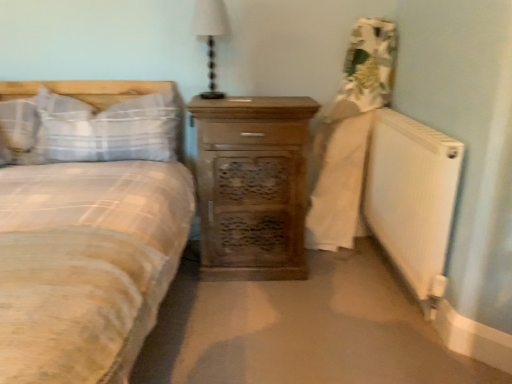
Question: Are wooden chest of drawers at center and white plaid pillow at left, which appears as the first pillow when viewed from the left, making contact?

Choices:
 (A) no
 (B) yes

Answer: (A)

Question: Considering the relative sizes of wooden chest of drawers at center and white plaid pillow at left, arranged as the second pillow when viewed from the right, in the image provided, is wooden chest of drawers at center shorter than white plaid pillow at left, arranged as the second pillow when viewed from the right,?

Choices:
 (A) no
 (B) yes

Answer: (A)

Question: Would you say wooden chest of drawers at center is outside white plaid pillow at left, arranged as the second pillow when viewed from the right?

Choices:
 (A) no
 (B) yes

Answer: (B)

Question: From a real-world perspective, is wooden chest of drawers at center positioned over white plaid pillow at left, arranged as the second pillow when viewed from the right, based on gravity?

Choices:
 (A) yes
 (B) no

Answer: (B)

Question: Is wooden chest of drawers at center to the right of white plaid pillow at left, which appears as the first pillow when viewed from the left, from the viewer's perspective?

Choices:
 (A) no
 (B) yes

Answer: (B)

Question: Does wooden chest of drawers at center have a greater width compared to white plaid pillow at left, which appears as the first pillow when viewed from the left?

Choices:
 (A) yes
 (B) no

Answer: (A)

Question: Is wooden chest of drawers at center positioned before white fabric lampshade at upper center?

Choices:
 (A) yes
 (B) no

Answer: (A)

Question: Is wooden chest of drawers at center taller than white fabric lampshade at upper center?

Choices:
 (A) yes
 (B) no

Answer: (A)

Question: From a real-world perspective, is wooden chest of drawers at center under white fabric lampshade at upper center?

Choices:
 (A) no
 (B) yes

Answer: (B)

Question: Is wooden chest of drawers at center bigger than white fabric lampshade at upper center?

Choices:
 (A) yes
 (B) no

Answer: (A)

Question: Is wooden chest of drawers at center outside of white fabric lampshade at upper center?

Choices:
 (A) yes
 (B) no

Answer: (A)

Question: Can you confirm if wooden chest of drawers at center is positioned to the right of white fabric lampshade at upper center?

Choices:
 (A) no
 (B) yes

Answer: (B)

Question: From the image's perspective, is white matte radiator at lower right beneath white plaid pillow at left, which appears as the first pillow when viewed from the left?

Choices:
 (A) no
 (B) yes

Answer: (B)